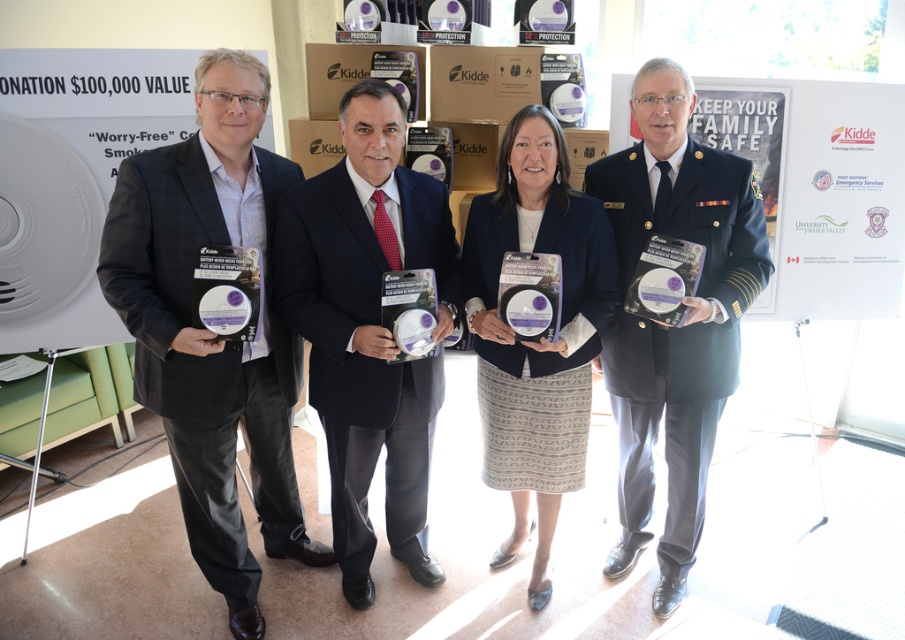
Is matte black suit at left taller than navy blue suit at center?

Indeed, matte black suit at left has a greater height compared to navy blue suit at center.

Which is in front, point (253, 120) or point (348, 570)?

Point (253, 120)

Which is behind, point (197, 115) or point (387, 368)?

Positioned behind is point (387, 368).

You are a GUI agent. You are given a task and a screenshot of the screen. Output one action in this format:
    pyautogui.click(x=<x>, y=<y>)
    Task: Click on the matte black suit at left
    Image resolution: width=905 pixels, height=640 pixels.
    Given the screenshot: What is the action you would take?
    pyautogui.click(x=210, y=330)

Who is more distant from viewer, (262,148) or (675,234)?

Point (262,148)

Between point (175, 394) and point (624, 500), which one is positioned in front?

Point (175, 394) is more forward.

What do you see at coordinates (210, 330) in the screenshot? I see `matte black suit at left` at bounding box center [210, 330].

Identify the location of matte black suit at left. (210, 330).

Between navy blue suit at center and dark blue uniform at center, which one has less height?

Standing shorter between the two is navy blue suit at center.

Does navy blue suit at center appear under dark blue uniform at center?

Correct, navy blue suit at center is located below dark blue uniform at center.

Which is in front, point (414, 212) or point (680, 195)?

Point (414, 212)

Identify the location of navy blue suit at center. (368, 326).